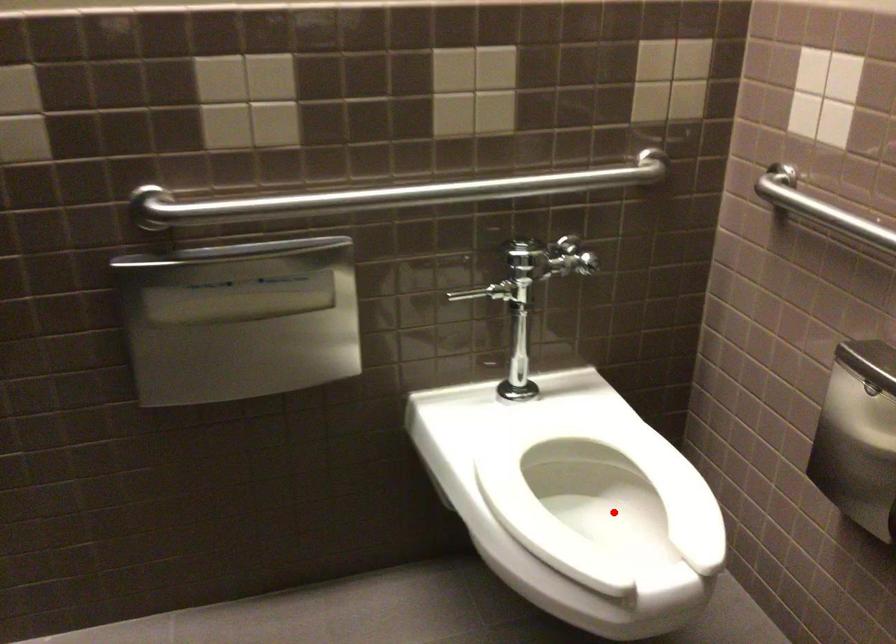
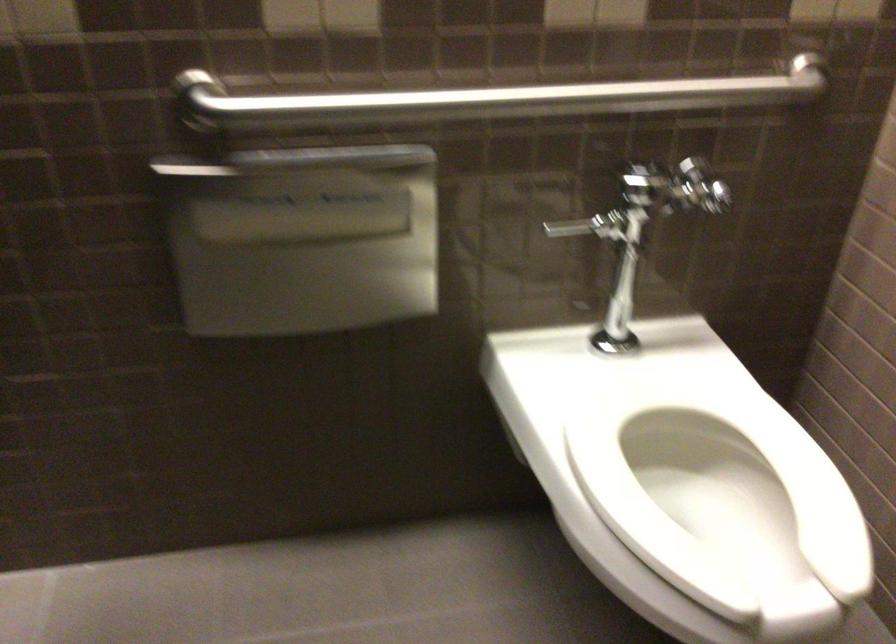
Locate, in the second image, the point that corresponds to the highlighted location in the first image.

(719, 494)